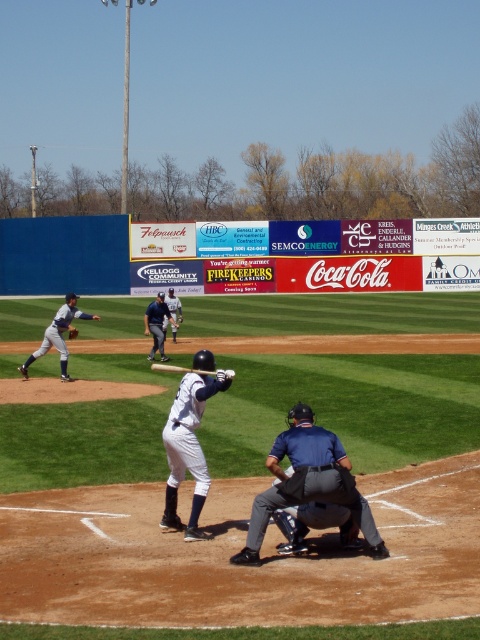
Question: Observing the image, what is the correct spatial positioning of matte gray uniform at left in reference to white uniform bat at center?

Choices:
 (A) below
 (B) above

Answer: (A)

Question: Which point appears farthest from the camera in this image?

Choices:
 (A) coord(215,372)
 (B) coord(160,296)

Answer: (B)

Question: Is white uniform bat at center wider than dark blue leather glove at center?

Choices:
 (A) yes
 (B) no

Answer: (A)

Question: Which of the following is the closest to the observer?

Choices:
 (A) white matte uniform at center
 (B) dark blue uniform at center
 (C) white uniform bat at center
 (D) matte gray uniform at left

Answer: (A)

Question: Can you confirm if white matte uniform at center is positioned above matte gray uniform at left?

Choices:
 (A) yes
 (B) no

Answer: (B)

Question: Which object is farther from the camera taking this photo?

Choices:
 (A) blue fabric umpire at center
 (B) wooden bat at center
 (C) dark blue leather glove at center
 (D) matte gray uniform at left

Answer: (C)